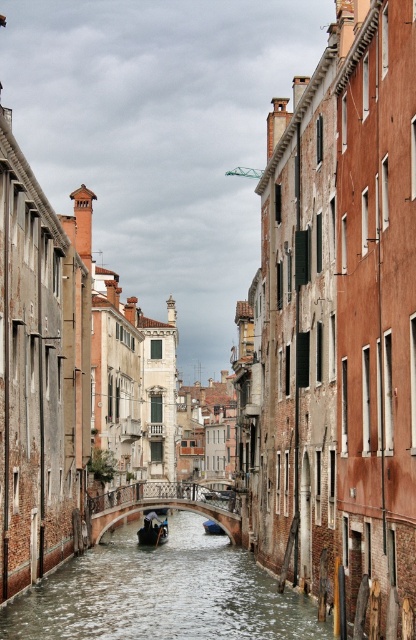
You are a tourist in Venice and want to take a photo of both the wooden polished boat at center and the blue glossy boat at center. Which boat should you position yourself to the right of to capture both in the frame?

You should position yourself to the right of the wooden polished boat at center because it is located to the left of the blue glossy boat at center, so positioning yourself to its right will allow you to capture both boats in the frame.

From the picture: You are a tourist in Venice standing on a bridge overlooking the canal. You want to take a photo of the blue glossy boat at center without any obstructions. Is the clear water at canal center blocking your view of the boat?

The clear water at canal center is in front of the blue glossy boat at center, so the water is blocking the view of the boat.

You are standing on the left bank of the canal and want to cross to the right bank using the clear water at canal center. Can you reach the right bank by walking directly towards the point marked by point (161, 593)?

The clear water at canal center is represented by point (161, 593), so yes, you can reach the right bank by walking directly towards that point as it indicates the path across the canal.